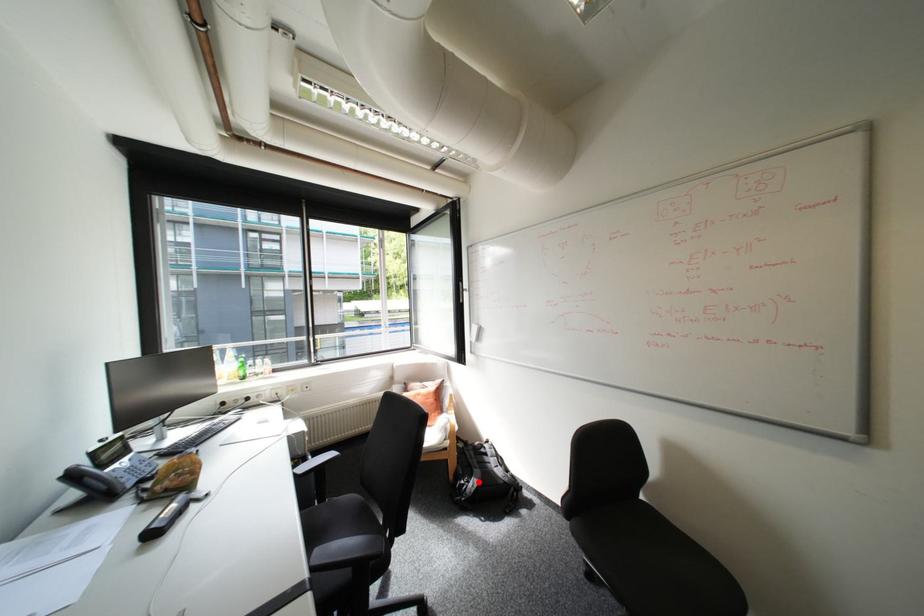
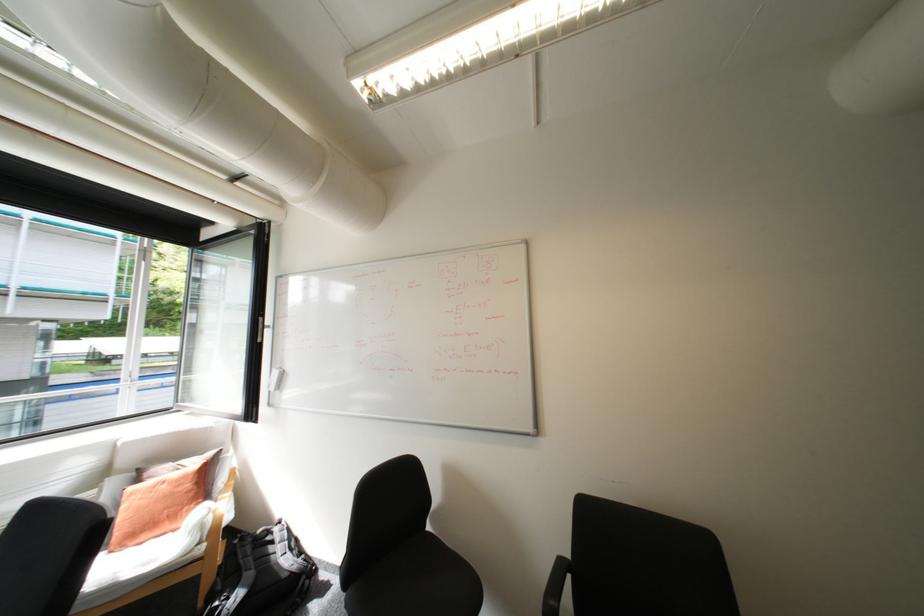
The point at the highlighted location is marked in the first image. Where is the corresponding point in the second image?

(238, 599)